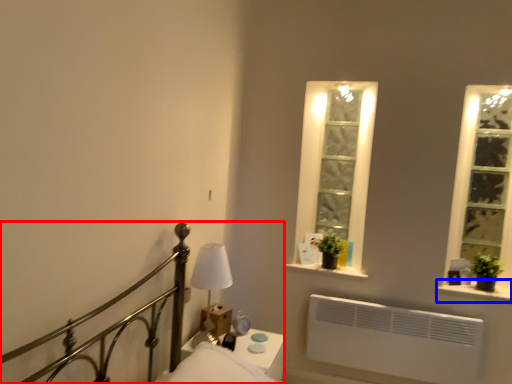
Question: Which of the following is the farthest to the observer, bed (highlighted by a red box) or window sill (highlighted by a blue box)?

Choices:
 (A) bed
 (B) window sill

Answer: (B)